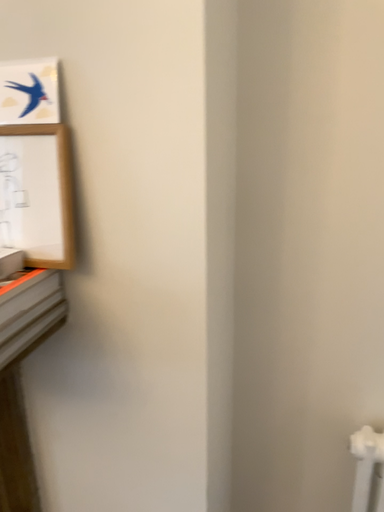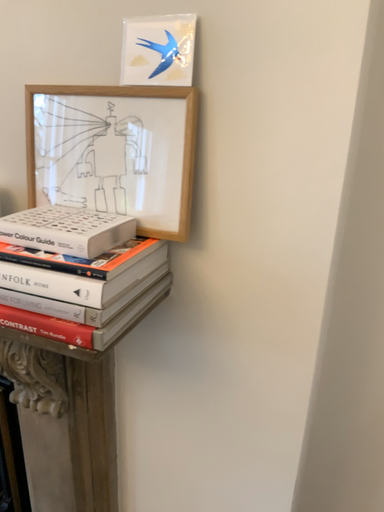
Question: Which way did the camera rotate in the video?

Choices:
 (A) rotated right
 (B) rotated left

Answer: (B)